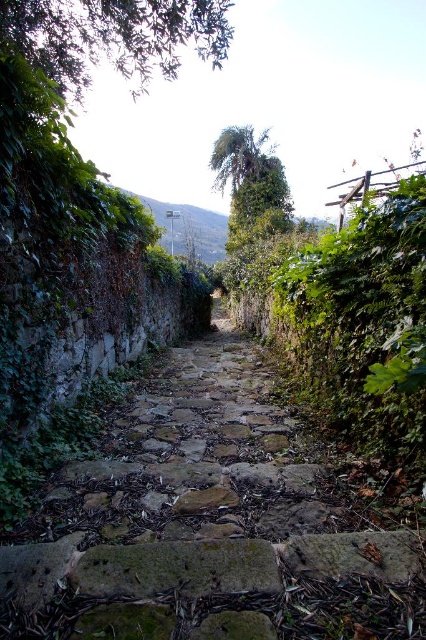
You are a hiker carrying a heavy backpack and need to step onto the green mossy stone at center. Given that your backpack adds 2 feet to your height, will you be able to see over the dense vegetation on either side of the pathway?

The green mossy stone at center is 6.25 feet from the camera. Since your backpack adds 2 feet to your height, you need to know your total height plus the backpack to determine visibility. However, without knowing your actual height, it is impossible to confirm if you can see over the vegetation.

You are standing at the camera position looking down the narrow, overgrown stone pathway. There is a point marked at coordinates (154, 580). Can you reach that point without stepping off the pathway?

The point at (154, 580) is 6.50 feet away from the camera. Since the pathway is narrow and overgrown with dense vegetation on both sides, you can reach the point by staying on the pathway as it is the only path available.

In the scene shown: You are a hiker trying to step on the green mossy stone at center and brown rough stone at center. Which stone should you avoid stepping on if you want to avoid the taller one?

You should avoid stepping on the brown rough stone at center because it has a greater height compared to the green mossy stone at center.